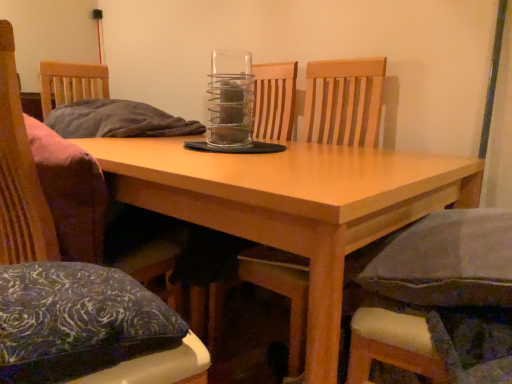
Question: Considering the relative sizes of wooden chair at left, which ranks as the 1th chair in left-to-right order, and wooden chair at center, which is the second chair in right-to-left order, in the image provided, is wooden chair at left, which ranks as the 1th chair in left-to-right order, wider than wooden chair at center, which is the second chair in right-to-left order,?

Choices:
 (A) yes
 (B) no

Answer: (B)

Question: Does wooden chair at left, which ranks as the 1th chair in left-to-right order, have a lesser width compared to wooden chair at center, which is the second chair in right-to-left order?

Choices:
 (A) yes
 (B) no

Answer: (A)

Question: Can you confirm if wooden chair at left, marked as the third chair in a right-to-left arrangement, is positioned to the right of wooden chair at center, which is the second chair from left to right?

Choices:
 (A) no
 (B) yes

Answer: (A)

Question: From the image's perspective, is wooden chair at left, marked as the third chair in a right-to-left arrangement, located above wooden chair at center, which is the second chair from left to right?

Choices:
 (A) yes
 (B) no

Answer: (B)

Question: Can you confirm if wooden chair at left, marked as the third chair in a right-to-left arrangement, is shorter than wooden chair at center, which is the second chair from left to right?

Choices:
 (A) yes
 (B) no

Answer: (A)

Question: Is wooden chair at left, marked as the third chair in a right-to-left arrangement, positioned beyond the bounds of wooden chair at center, which is the second chair from left to right?

Choices:
 (A) no
 (B) yes

Answer: (B)

Question: Does light wood table at center have a larger size compared to wooden chair at left, marked as the third chair in a right-to-left arrangement?

Choices:
 (A) no
 (B) yes

Answer: (B)

Question: Is light wood table at center aimed at wooden chair at left, which ranks as the 1th chair in left-to-right order?

Choices:
 (A) yes
 (B) no

Answer: (A)

Question: Does light wood table at center have a smaller size compared to wooden chair at left, which ranks as the 1th chair in left-to-right order?

Choices:
 (A) no
 (B) yes

Answer: (A)

Question: Is light wood table at center positioned far away from wooden chair at left, marked as the third chair in a right-to-left arrangement?

Choices:
 (A) yes
 (B) no

Answer: (B)

Question: Is light wood table at center to the left of wooden chair at left, marked as the third chair in a right-to-left arrangement, from the viewer's perspective?

Choices:
 (A) no
 (B) yes

Answer: (A)

Question: Is light wood table at center thinner than wooden chair at left, which ranks as the 1th chair in left-to-right order?

Choices:
 (A) no
 (B) yes

Answer: (A)

Question: From the image's perspective, is fabric cushioned chair at lower right, positioned as the 1th chair in right-to-left order, over light wood table at center?

Choices:
 (A) no
 (B) yes

Answer: (B)